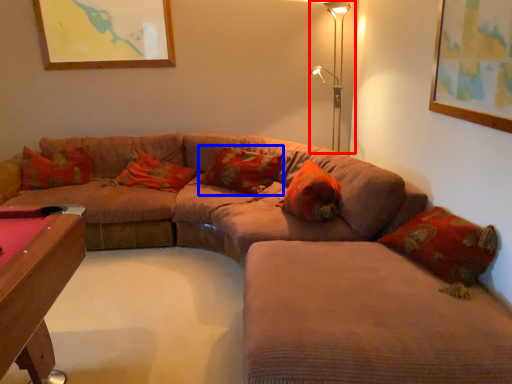
Question: Which object appears closest to the camera in this image, table lamp (highlighted by a red box) or pillow (highlighted by a blue box)?

Choices:
 (A) table lamp
 (B) pillow

Answer: (B)